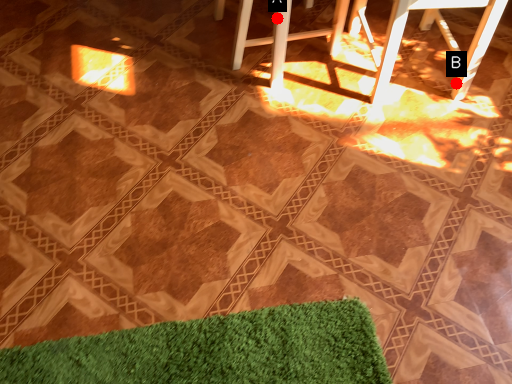
Question: Two points are circled on the image, labeled by A and B beside each circle. Which of the following is the closest to the observer?

Choices:
 (A) A is closer
 (B) B is closer

Answer: (A)